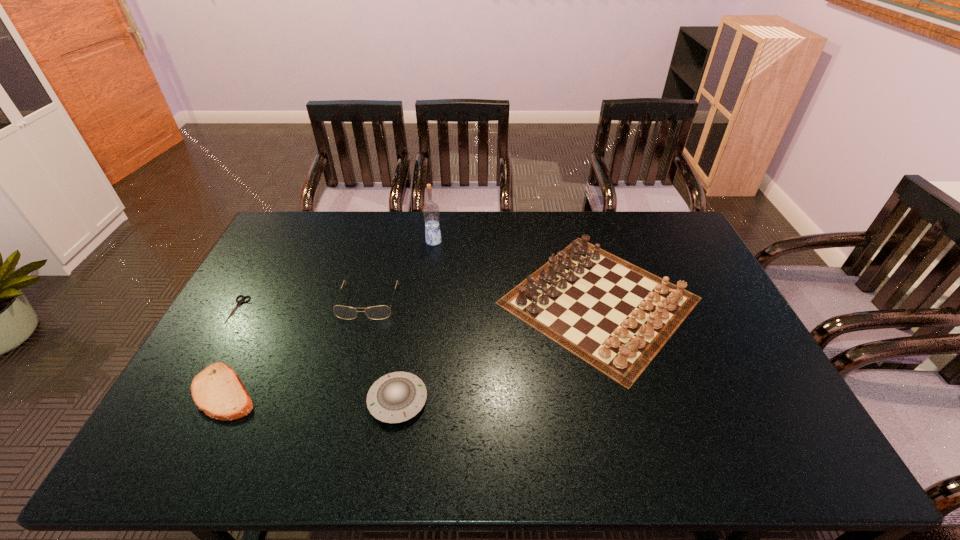
The width and height of the screenshot is (960, 540). Find the location of `vacant space at the near edge`. vacant space at the near edge is located at coordinates (459, 465).

Locate an element on the screen. vacant space at the left edge of the desktop is located at coordinates (259, 357).

In the image, there is a desktop. Where is `vacant space at the right edge`? This screenshot has width=960, height=540. vacant space at the right edge is located at coordinates (750, 376).

At what (x,y) coordinates should I click in order to perform the action: click on vacant region at the far right corner of the desktop. Please return your answer as a coordinate pair (x, y). The width and height of the screenshot is (960, 540). Looking at the image, I should click on (665, 242).

Image resolution: width=960 pixels, height=540 pixels. In order to click on vacant space that's between the tallest object and the shears in this screenshot , I will do `click(336, 275)`.

Locate an element on the screen. Image resolution: width=960 pixels, height=540 pixels. unoccupied area between the fifth shortest object and the tallest object is located at coordinates (516, 271).

This screenshot has width=960, height=540. Find the location of `vacant area that lies between the spectacles and the second tallest object`. vacant area that lies between the spectacles and the second tallest object is located at coordinates [x=484, y=301].

This screenshot has height=540, width=960. Identify the location of free spot between the vodka and the fifth shortest object. (516, 271).

Where is `vacant point located between the shears and the saucer`? Image resolution: width=960 pixels, height=540 pixels. vacant point located between the shears and the saucer is located at coordinates (318, 355).

Identify the location of vacant area that lies between the pita bread and the fourth shortest object. (297, 347).